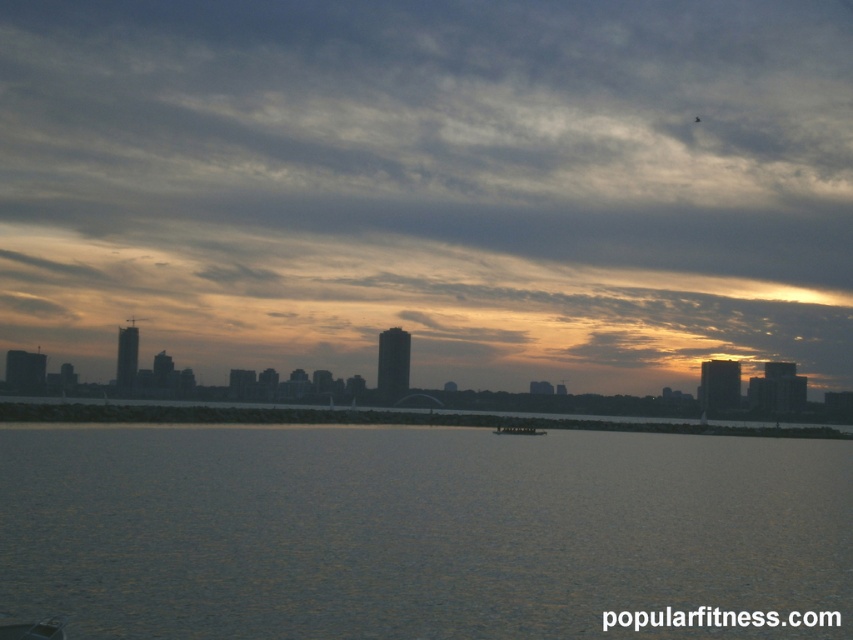
Question: Which of the following is the farthest from the observer?

Choices:
 (A) tap(10, 230)
 (B) tap(511, 433)
 (C) tap(558, 560)

Answer: (A)

Question: Is cloudy sky at center bigger than silvery reflective water at center?

Choices:
 (A) no
 (B) yes

Answer: (B)

Question: Can you confirm if cloudy sky at center is wider than silvery reflective water at center?

Choices:
 (A) no
 (B) yes

Answer: (B)

Question: Is the position of silvery reflective water at center less distant than that of metallic silver boat at center?

Choices:
 (A) no
 (B) yes

Answer: (B)

Question: Which object is farther from the camera taking this photo?

Choices:
 (A) silvery reflective water at center
 (B) cloudy sky at center

Answer: (B)

Question: Which object appears closest to the camera in this image?

Choices:
 (A) cloudy sky at center
 (B) metallic silver boat at center

Answer: (B)